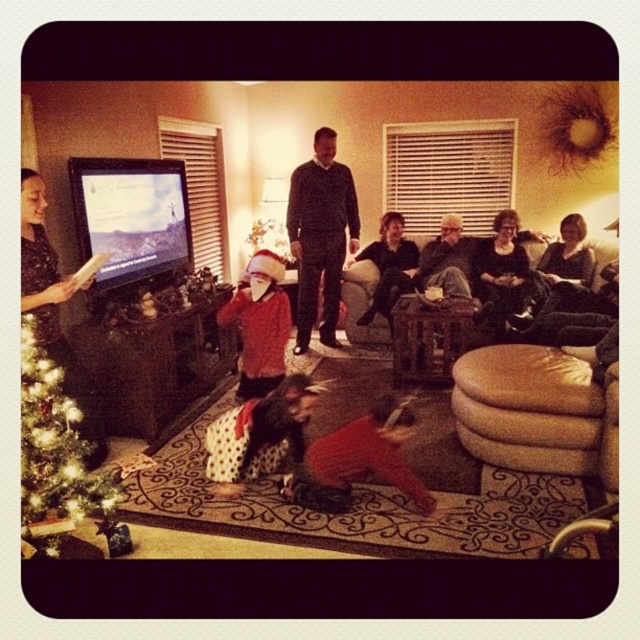
Question: Can you confirm if green glittering christmas tree at lower left is bigger than white dotted fabric at center?

Choices:
 (A) no
 (B) yes

Answer: (B)

Question: Which point appears farthest from the camera in this image?

Choices:
 (A) (276, 464)
 (B) (339, 250)
 (C) (394, 456)
 (D) (362, 250)

Answer: (D)

Question: Which object appears closest to the camera in this image?

Choices:
 (A) white dotted fabric at center
 (B) velvet red pajamas at lower center
 (C) dark gray sweater at center
 (D) green glittering christmas tree at lower left

Answer: (D)

Question: Does white dotted fabric at center appear over dark gray sweater at center?

Choices:
 (A) no
 (B) yes

Answer: (A)

Question: Observing the image, what is the correct spatial positioning of green glittering christmas tree at lower left in reference to sweater-knit sweater at center?

Choices:
 (A) left
 (B) right

Answer: (A)

Question: Which point is farther to the camera?

Choices:
 (A) dark gray sweater at center
 (B) white dotted fabric at center

Answer: (A)